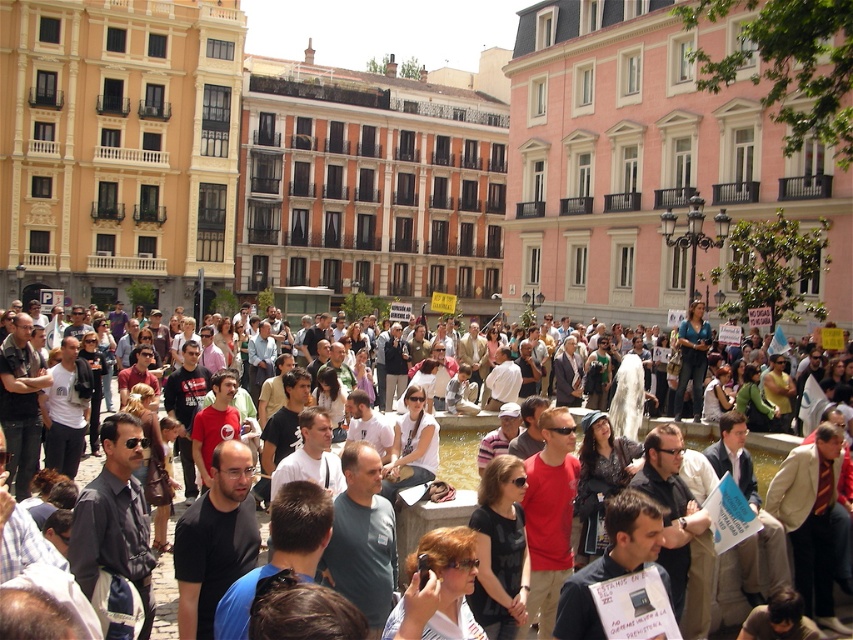
Consider the image. You are standing in the public square and want to take a photo of both the point at coordinates (625, 461) and the point at (392, 499). Which point should you focus on first to ensure both are in focus?

You should focus on the point at coordinates (625, 461) first because it is closer to the camera than the point at (392, 499). This ensures that both points will be in focus as the closer point sets the focal plane.

From the picture: You are a photographer trying to capture a clear shot of both the black fabric shirt at center and the matte white shirt at center in the crowd. Since you want both shirts to appear equally sized in the photo, which shirt should you move closer to the camera?

The black fabric shirt at center is taller than the matte white shirt at center, so to make them appear the same size in the photo, you should move the matte white shirt at center closer to the camera while keeping the black fabric shirt at center farther back.

You are a photographer standing in the public square and want to take a photo of the black fabric shirt at center and the leather jacket at center. Which of the two items should you focus on first to ensure they both are in focus?

The black fabric shirt at center is taller than the leather jacket at center, so focusing on the black fabric shirt at center first will ensure both are in focus since it is the taller object.